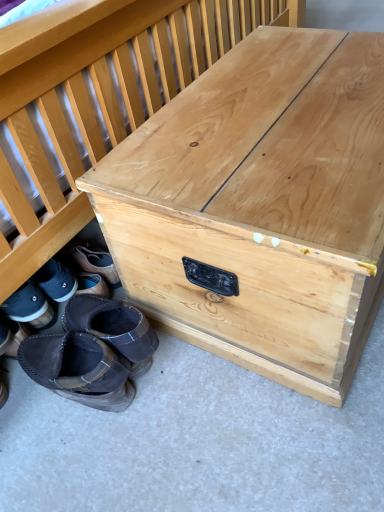
This screenshot has width=384, height=512. Find the location of `free point above natural wood trunk at center (from a real-world perspective)`. free point above natural wood trunk at center (from a real-world perspective) is located at coordinates (290, 100).